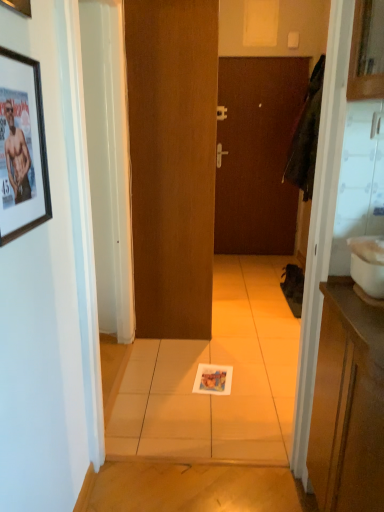
Question: Is brown matte door at center, the first door positioned from the front, smaller than white glossy sink at right?

Choices:
 (A) yes
 (B) no

Answer: (B)

Question: Is brown matte door at center, the 2th door viewed from the back, not within white glossy sink at right?

Choices:
 (A) yes
 (B) no

Answer: (A)

Question: Is brown matte door at center, the first door positioned from the front, aimed at white glossy sink at right?

Choices:
 (A) no
 (B) yes

Answer: (A)

Question: Considering the relative sizes of brown matte door at center, the 1th door from the left, and white glossy sink at right in the image provided, is brown matte door at center, the 1th door from the left, thinner than white glossy sink at right?

Choices:
 (A) yes
 (B) no

Answer: (A)

Question: From the image's perspective, would you say brown matte door at center, the 1th door from the left, is shown under white glossy sink at right?

Choices:
 (A) yes
 (B) no

Answer: (B)

Question: From the image's perspective, relative to matte black picture frame at upper left, which is the 2th picture frame from top to bottom, is white glossy sink at right above or below?

Choices:
 (A) above
 (B) below

Answer: (B)

Question: In terms of size, does white glossy sink at right appear bigger or smaller than matte black picture frame at upper left, the 1th picture frame from the bottom?

Choices:
 (A) small
 (B) big

Answer: (B)

Question: In the image, is white glossy sink at right positioned in front of or behind matte black picture frame at upper left, the 1th picture frame from the bottom?

Choices:
 (A) behind
 (B) front

Answer: (A)

Question: Considering the positions of point (370, 258) and point (4, 154), is point (370, 258) closer or farther from the camera than point (4, 154)?

Choices:
 (A) closer
 (B) farther

Answer: (B)

Question: Is brushed metal picture frame at upper left, which is counted as the second picture frame, starting from the bottom, inside or outside of brown matte door at center, which is the 2th door in front-to-back order?

Choices:
 (A) outside
 (B) inside

Answer: (A)

Question: Considering the relative positions of brushed metal picture frame at upper left, which appears as the first picture frame when viewed from the top, and brown matte door at center, positioned as the second door in left-to-right order, in the image provided, is brushed metal picture frame at upper left, which appears as the first picture frame when viewed from the top, to the left or to the right of brown matte door at center, positioned as the second door in left-to-right order,?

Choices:
 (A) right
 (B) left

Answer: (B)

Question: Considering the positions of brushed metal picture frame at upper left, which is counted as the second picture frame, starting from the bottom, and brown matte door at center, marked as the 1th door in a back-to-front arrangement, in the image, is brushed metal picture frame at upper left, which is counted as the second picture frame, starting from the bottom, wider or thinner than brown matte door at center, marked as the 1th door in a back-to-front arrangement,?

Choices:
 (A) wide
 (B) thin

Answer: (B)

Question: Considering the positions of point (14, 10) and point (241, 102), is point (14, 10) closer or farther from the camera than point (241, 102)?

Choices:
 (A) closer
 (B) farther

Answer: (A)

Question: Is brown matte door at center, the first door positioned from the right, taller or shorter than matte black picture frame at upper left, which is the 2th picture frame from top to bottom?

Choices:
 (A) tall
 (B) short

Answer: (A)

Question: Considering their positions, is brown matte door at center, which is the 2th door in front-to-back order, located in front of or behind matte black picture frame at upper left, which is the 2th picture frame from top to bottom?

Choices:
 (A) front
 (B) behind

Answer: (B)